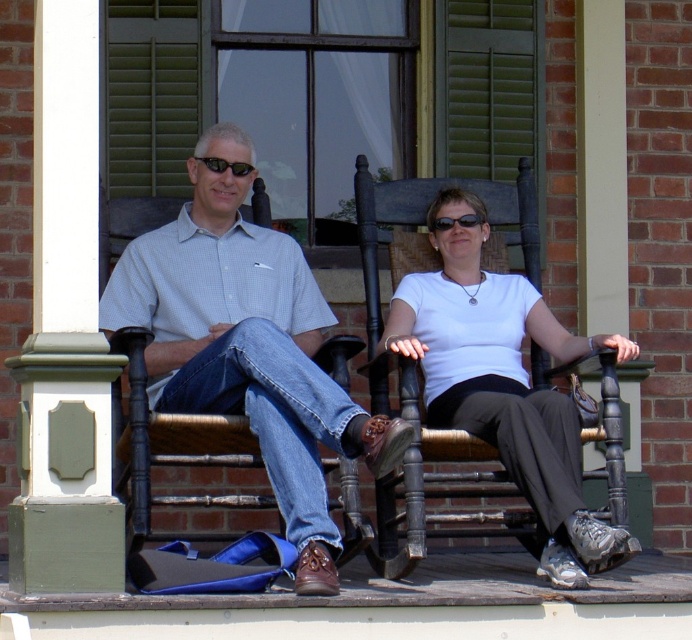
Who is more forward, (268,253) or (453,188)?

Point (268,253) is in front.

Does point (219, 324) come in front of point (466, 268)?

Yes, it is.

Where is `light blue checkered shirt at center`? light blue checkered shirt at center is located at coordinates (246, 346).

Does light blue checkered shirt at center appear under black plastic sunglasses at upper center?

Yes, light blue checkered shirt at center is below black plastic sunglasses at upper center.

Image resolution: width=692 pixels, height=640 pixels. What are the coordinates of `light blue checkered shirt at center` in the screenshot? It's located at (246, 346).

Is point (495, 333) less distant than point (215, 172)?

That is True.

Does point (545, 544) come behind point (210, 164)?

That is False.

Between point (516, 481) and point (210, 157), which one is positioned behind?

The point (210, 157) is behind.

The image size is (692, 640). In order to click on white matte shirt at center in this screenshot , I will do `click(502, 381)`.